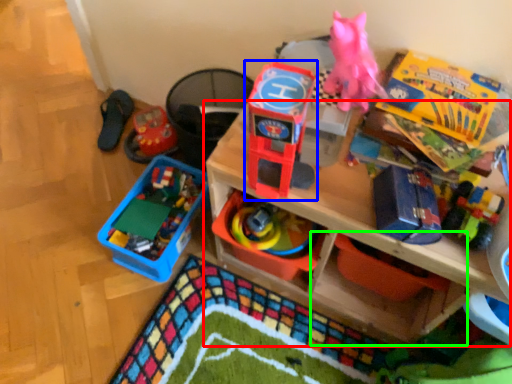
Question: Considering the real-world distances, which object is farthest from shelf (highlighted by a red box)? toy (highlighted by a blue box) or storage box (highlighted by a green box)?

Choices:
 (A) toy
 (B) storage box

Answer: (A)